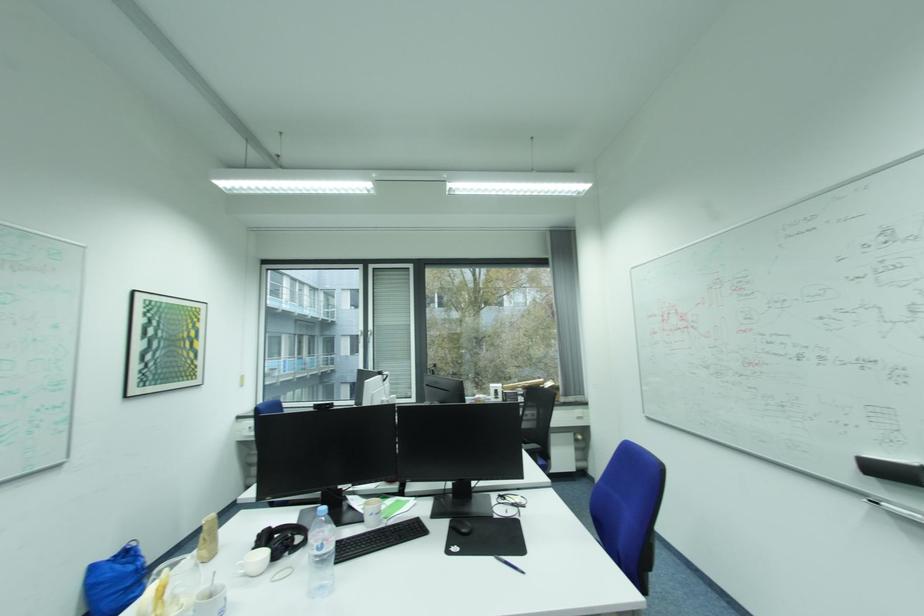
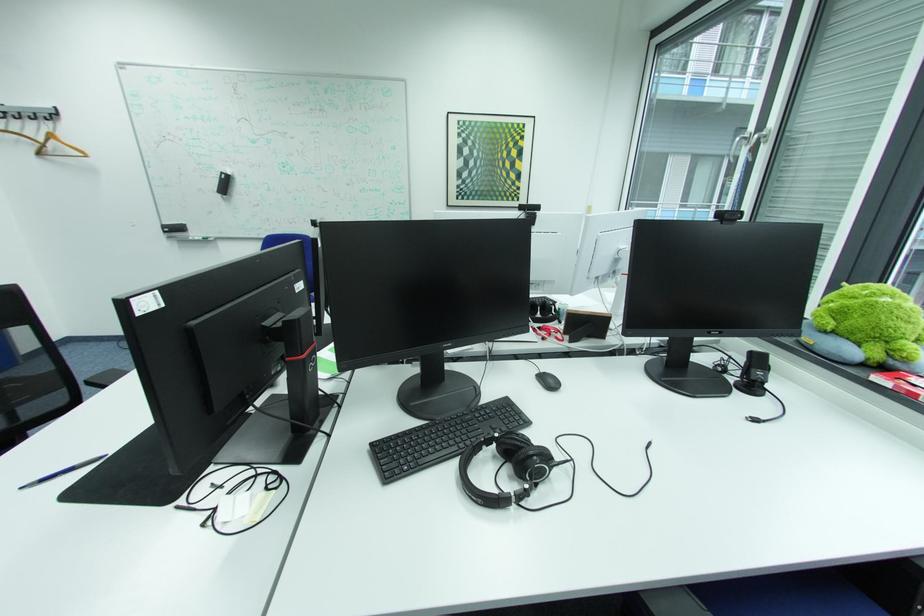
Where in the second image is the point corresponding to point 33,398 from the first image?

(393, 195)